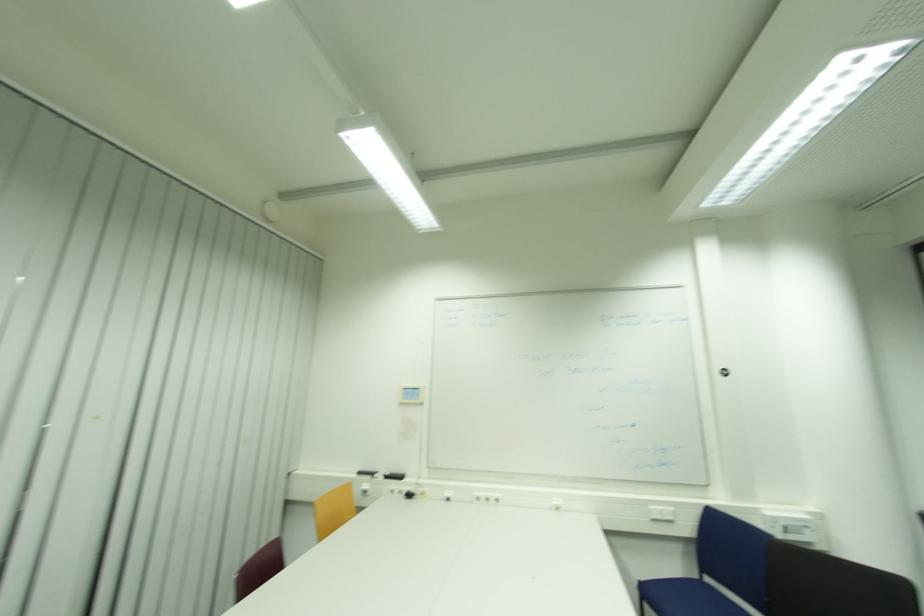
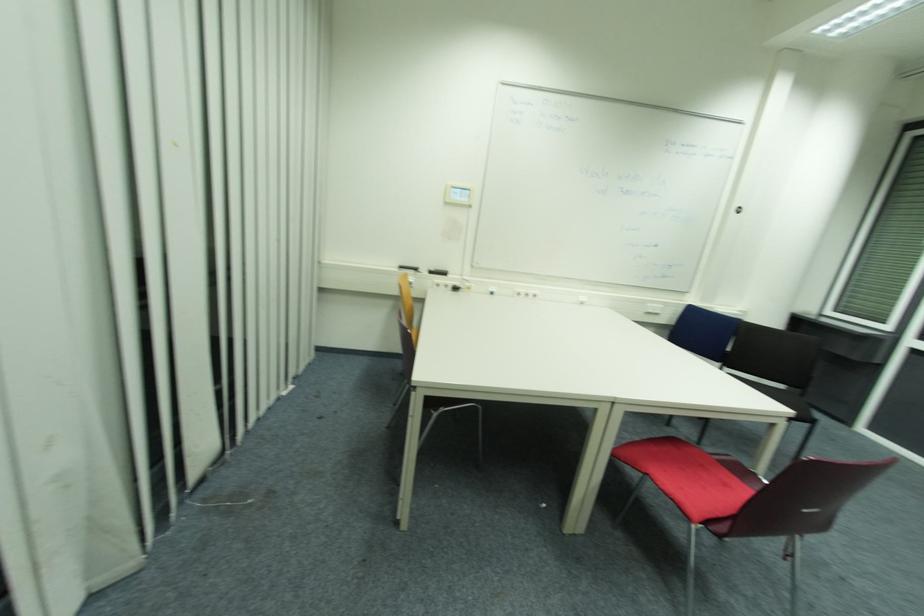
Locate, in the second image, the point that corresponds to (x=390, y=477) in the first image.

(433, 273)